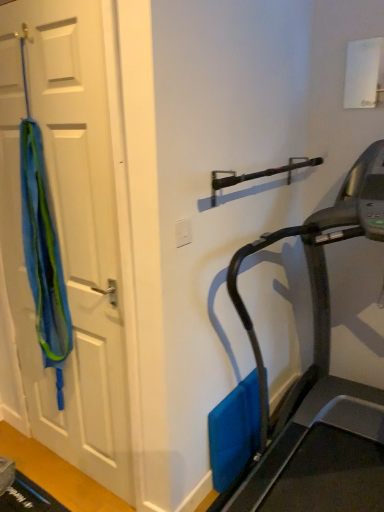
Question: Should I look upward or downward to see blue fabric at left?

Choices:
 (A) down
 (B) up

Answer: (B)

Question: From the image's perspective, does black metallic door handle at upper center appear lower than blue fabric at left?

Choices:
 (A) yes
 (B) no

Answer: (B)

Question: Can you confirm if black metallic door handle at upper center is positioned to the left of blue fabric at left?

Choices:
 (A) yes
 (B) no

Answer: (B)

Question: Considering the relative sizes of black metallic door handle at upper center and blue fabric at left in the image provided, is black metallic door handle at upper center taller than blue fabric at left?

Choices:
 (A) yes
 (B) no

Answer: (B)

Question: Is there a large distance between black metallic door handle at upper center and blue fabric at left?

Choices:
 (A) no
 (B) yes

Answer: (A)

Question: Is black metallic door handle at upper center positioned beyond the bounds of blue fabric at left?

Choices:
 (A) yes
 (B) no

Answer: (A)

Question: Considering the relative sizes of black metallic door handle at upper center and blue fabric at left in the image provided, is black metallic door handle at upper center bigger than blue fabric at left?

Choices:
 (A) no
 (B) yes

Answer: (A)

Question: Considering the relative positions of black metallic door handle at upper center and white plastic electric outlet at center in the image provided, is black metallic door handle at upper center behind white plastic electric outlet at center?

Choices:
 (A) no
 (B) yes

Answer: (A)

Question: Does black metallic door handle at upper center have a lesser height compared to white plastic electric outlet at center?

Choices:
 (A) no
 (B) yes

Answer: (A)

Question: From a real-world perspective, is black metallic door handle at upper center positioned under white plastic electric outlet at center based on gravity?

Choices:
 (A) yes
 (B) no

Answer: (B)

Question: Is black metallic door handle at upper center placed right next to white plastic electric outlet at center?

Choices:
 (A) yes
 (B) no

Answer: (B)

Question: Is black metallic door handle at upper center bigger than white plastic electric outlet at center?

Choices:
 (A) no
 (B) yes

Answer: (B)

Question: Is black metallic door handle at upper center taller than white plastic electric outlet at center?

Choices:
 (A) yes
 (B) no

Answer: (A)

Question: Can you confirm if blue fabric at left is wider than blue fabric at left?

Choices:
 (A) yes
 (B) no

Answer: (B)